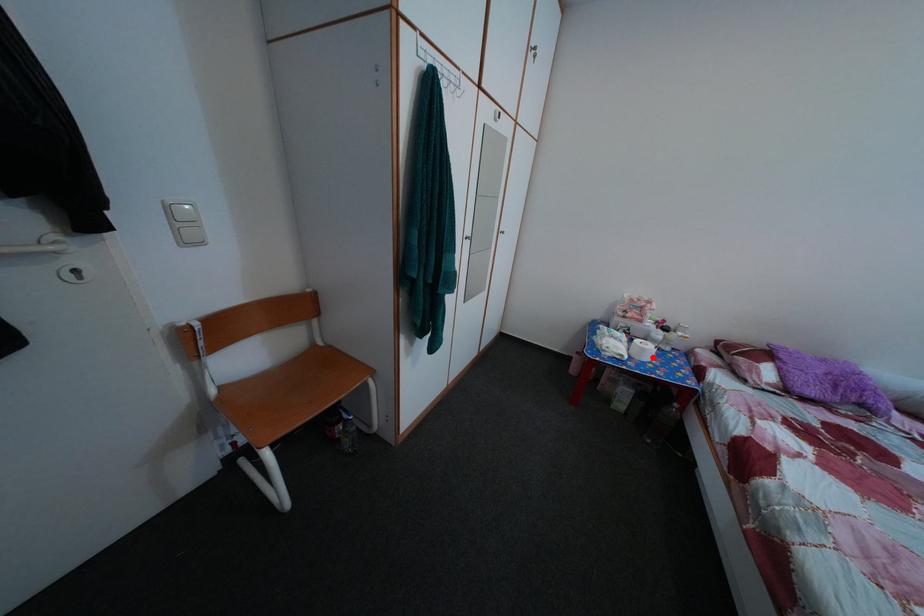
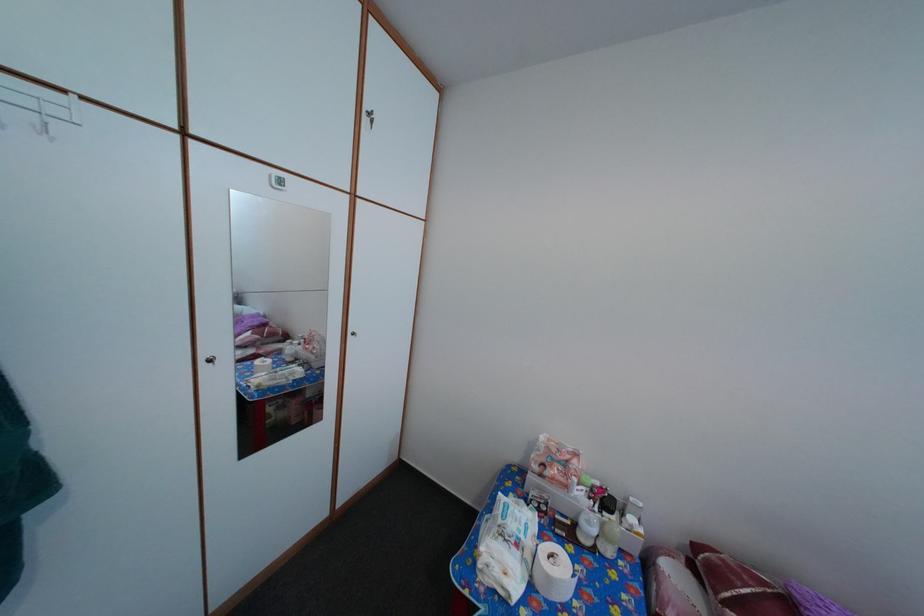
Question: I am providing you with two images of the same scene from different viewpoints. A red point is shown in image1. For the corresponding object point in image2, is it positioned nearer or farther from the camera?

Choices:
 (A) Nearer
 (B) Farther

Answer: (B)